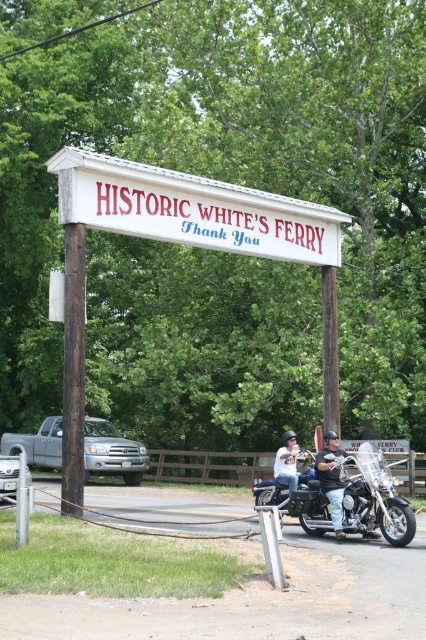
Who is taller, shiny chrome motorcycle at center or shiny blue motorcycle at center?

With more height is shiny chrome motorcycle at center.

The width and height of the screenshot is (426, 640). What do you see at coordinates (353, 497) in the screenshot?
I see `shiny chrome motorcycle at center` at bounding box center [353, 497].

This screenshot has height=640, width=426. Identify the location of shiny chrome motorcycle at center. (353, 497).

Is point (371, 444) closer to camera compared to point (80, 380)?

No, it is not.

Who is more distant from viewer, (x=380, y=451) or (x=71, y=426)?

Positioned behind is point (x=380, y=451).

You are a GUI agent. You are given a task and a screenshot of the screen. Output one action in this format:
    pyautogui.click(x=<x>, y=<y>)
    Task: Click on the shiny chrome motorcycle at center
    
    Given the screenshot: What is the action you would take?
    pyautogui.click(x=353, y=497)

Between point (264, 492) and point (287, 468), which one is positioned behind?

The point (264, 492) is behind.

Does shiny blue motorcycle at center appear on the left side of white leather jacket at center?

No, shiny blue motorcycle at center is not to the left of white leather jacket at center.

Where is `shiny blue motorcycle at center`? The image size is (426, 640). shiny blue motorcycle at center is located at coordinates (270, 493).

Where is `shiny blue motorcycle at center`? This screenshot has width=426, height=640. shiny blue motorcycle at center is located at coordinates (270, 493).